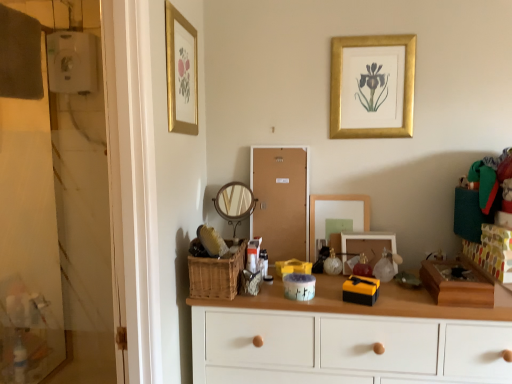
This screenshot has height=384, width=512. Identify the location of vacant space to the left of wooden box at right. (404, 301).